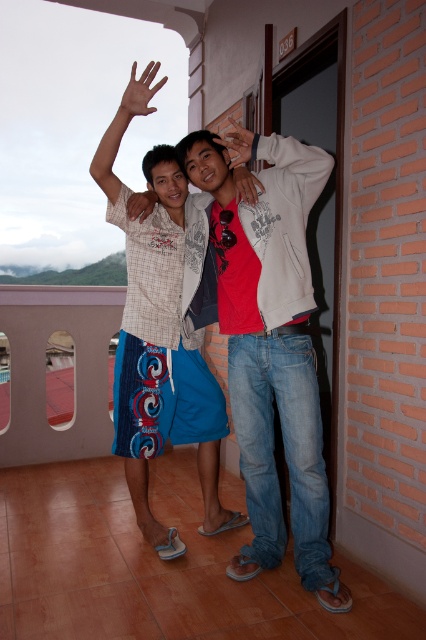
You are a photographer trying to capture the perfect shot of the blue denim shorts at left. Given their position at point coordinates, can you estimate where exactly they are located in the image?

The blue denim shorts at left are located at the coordinates point of (x=267, y=340).

You are a photographer capturing a candid shot of two friends on a balcony. You notice the brown matte hand at upper left and the matte white hand at center. Which hand appears to be closer to the camera?

The brown matte hand at upper left is positioned over the matte white hand at center, indicating it is closer to the camera.